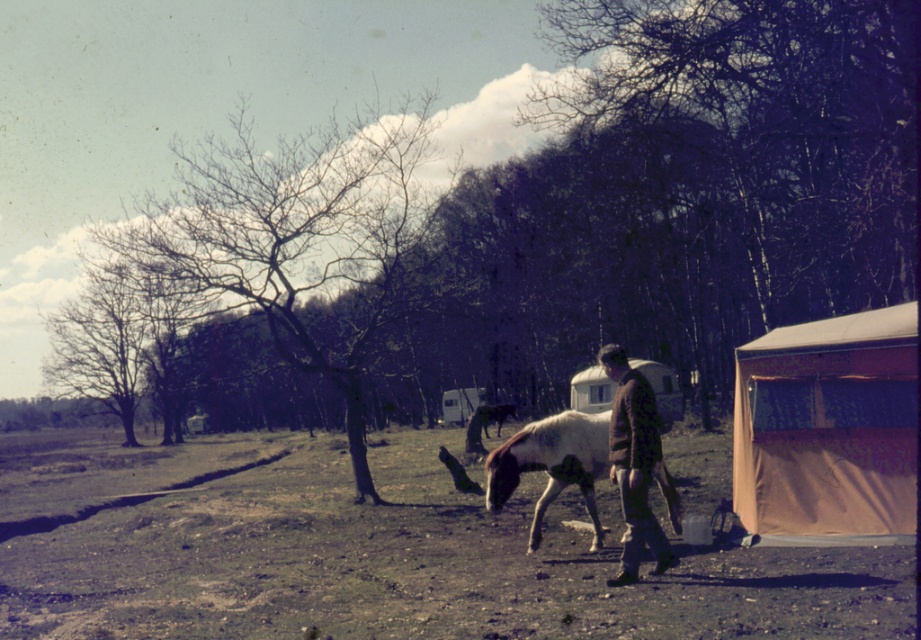
Question: From the image, what is the correct spatial relationship of white and brown speckled horse at center in relation to pink fabric tent at right?

Choices:
 (A) left
 (B) right

Answer: (A)

Question: Is brown dirt field at lower center thinner than pink fabric tent at right?

Choices:
 (A) no
 (B) yes

Answer: (A)

Question: Which point is farther from the camera taking this photo?

Choices:
 (A) (607, 474)
 (B) (498, 433)

Answer: (B)

Question: In this image, where is tan canvas tent at lower right located relative to white and brown speckled horse at center?

Choices:
 (A) above
 (B) below

Answer: (A)

Question: Among these objects, which one is nearest to the camera?

Choices:
 (A) tan canvas tent at lower right
 (B) white glossy horse at center
 (C) brown dirt field at lower center
 (D) brown woolen sweater at center

Answer: (C)

Question: Which point appears closest to the camera in this image?

Choices:
 (A) (496, 422)
 (B) (645, 380)
 (C) (430, 454)
 (D) (659, 365)

Answer: (B)